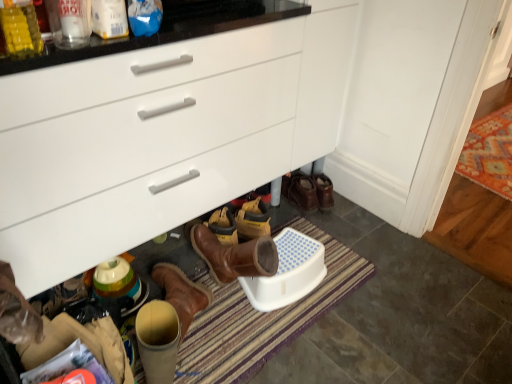
Question: Considering the positions of orange patterned rug at lower right and white plastic phone at lower center in the image, is orange patterned rug at lower right bigger or smaller than white plastic phone at lower center?

Choices:
 (A) big
 (B) small

Answer: (A)

Question: From the image's perspective, is orange patterned rug at lower right above or below white plastic phone at lower center?

Choices:
 (A) below
 (B) above

Answer: (B)

Question: Which object is positioned closest to the leather handbag at lower left?

Choices:
 (A) orange patterned rug at lower right
 (B) white glossy cabinet at center
 (C) white plastic phone at lower center
 (D) striped fabric bath mat at lower center
 (E) leather shoes at center

Answer: (D)

Question: Which of these objects is positioned farthest from the orange patterned rug at lower right?

Choices:
 (A) leather handbag at lower left
 (B) leather shoes at center
 (C) white plastic phone at lower center
 (D) white glossy cabinet at center
 (E) striped fabric bath mat at lower center

Answer: (A)